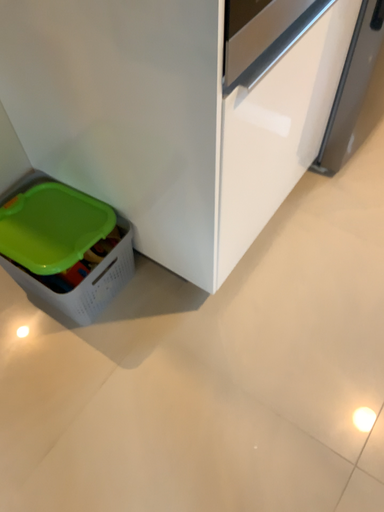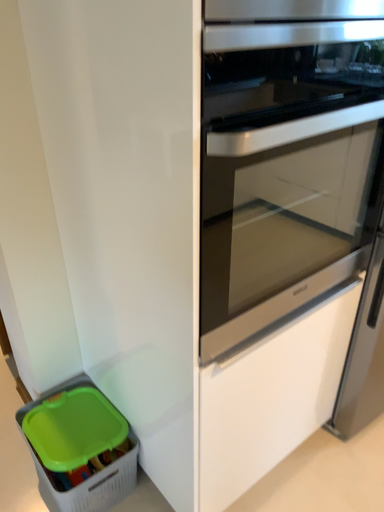
Question: How did the camera likely rotate when shooting the video?

Choices:
 (A) rotated right
 (B) rotated left

Answer: (B)